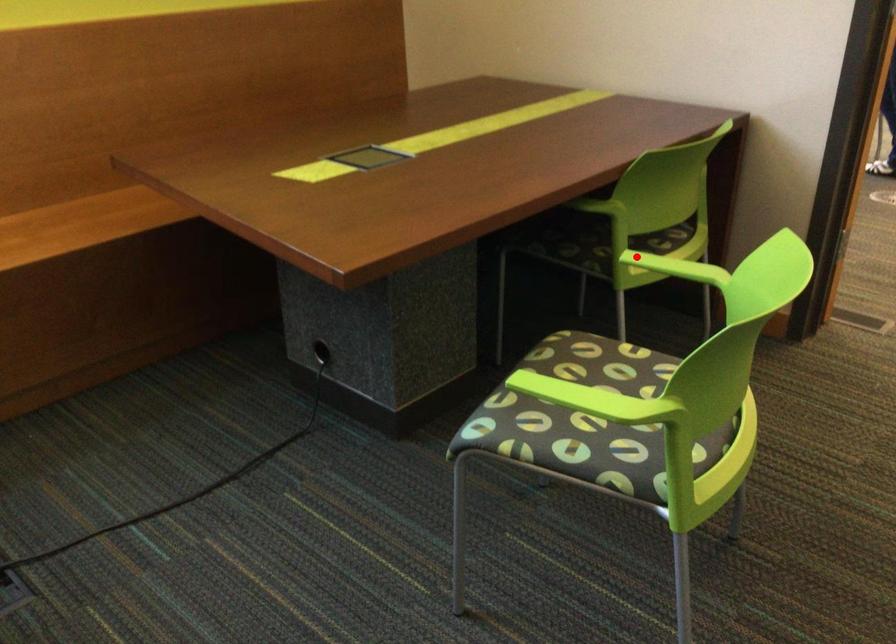
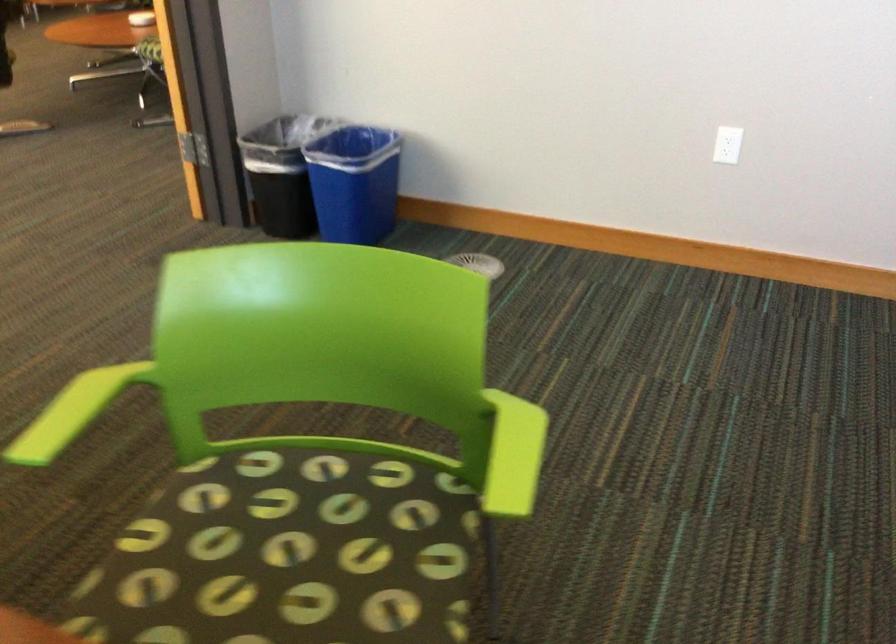
Question: A red point is marked in image1. In image2, is the corresponding 3D point closer to the camera or farther? Reply with the corresponding letter.

Choices:
 (A) The corresponding 3D point is closer.
 (B) The corresponding 3D point is farther.

Answer: (A)